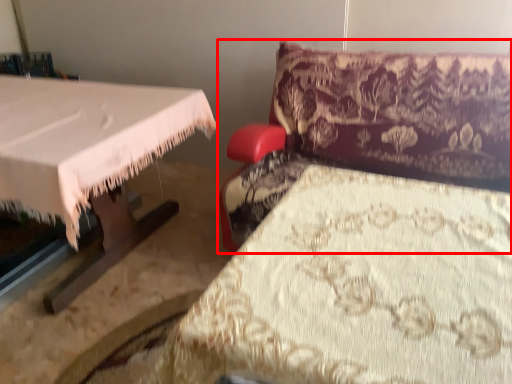
Question: Considering the relative positions of furniture (annotated by the red box) and sheet in the image provided, where is furniture (annotated by the red box) located with respect to the staircase?

Choices:
 (A) left
 (B) right

Answer: (B)